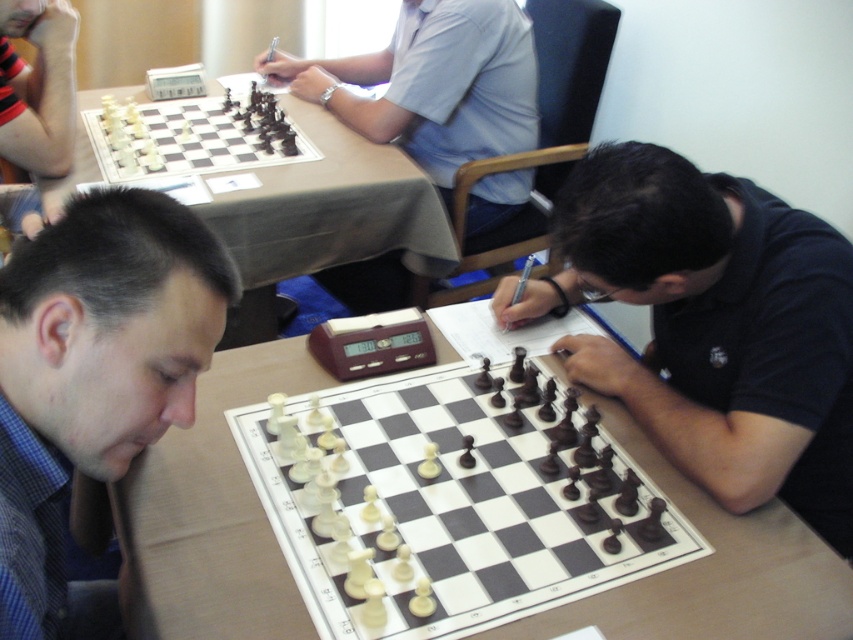
Which is in front, point (26, 259) or point (49, 36)?

Point (26, 259) is in front.

How much distance is there between blue checkered shirt at lower left and striped fabric arm at upper left?

blue checkered shirt at lower left is 4.53 feet away from striped fabric arm at upper left.

What do you see at coordinates (94, 369) in the screenshot? I see `blue checkered shirt at lower left` at bounding box center [94, 369].

The width and height of the screenshot is (853, 640). What are the coordinates of `blue checkered shirt at lower left` in the screenshot? It's located at (94, 369).

Between wooden chessboard at center and white plastic chess pieces at upper left, which one has less height?

white plastic chess pieces at upper left is shorter.

Is wooden chessboard at center wider than white plastic chess pieces at upper left?

No.

The height and width of the screenshot is (640, 853). Find the location of `wooden chessboard at center`. wooden chessboard at center is located at coordinates (326, 218).

Can you confirm if matte light blue shirt at upper center is shorter than white plastic chess pieces at upper left?

No, matte light blue shirt at upper center is not shorter than white plastic chess pieces at upper left.

Between matte light blue shirt at upper center and white plastic chess pieces at upper left, which one is positioned lower?

white plastic chess pieces at upper left

Image resolution: width=853 pixels, height=640 pixels. What do you see at coordinates (434, 84) in the screenshot? I see `matte light blue shirt at upper center` at bounding box center [434, 84].

Find the location of `matte light blue shirt at upper center`. matte light blue shirt at upper center is located at coordinates (434, 84).